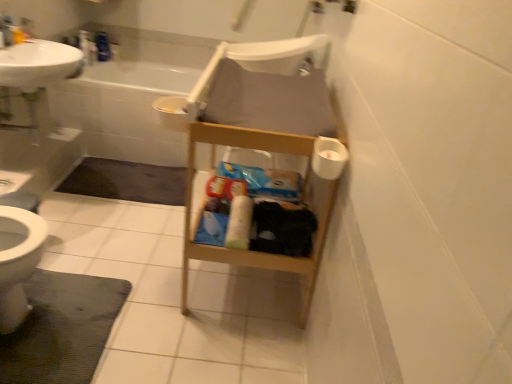
Question: Looking at their shapes, would you say white plastic chair at center is wider or thinner than dark gray textured bath mat at lower left, acting as the second bath mat starting from the top?

Choices:
 (A) thin
 (B) wide

Answer: (B)

Question: Is white plastic chair at center to the left or to the right of dark gray textured bath mat at lower left, the 1th bath mat when ordered from front to back, in the image?

Choices:
 (A) left
 (B) right

Answer: (B)

Question: Which object is positioned farthest from the white matte toilet paper at center, the second toilet paper in the right-to-left sequence?

Choices:
 (A) white plastic chair at center
 (B) white matte toilet paper at right, positioned as the 2th toilet paper in left-to-right order
 (C) dark gray textured bath mat at lower left, which is the 1th bath mat from bottom to top
 (D) dark gray carpet at lower left, which is the 1th bath mat in back-to-front order
 (E) white glossy sink at upper left

Answer: (A)

Question: Considering the real-world distances, which object is farthest from the white matte toilet paper at right, the 2th toilet paper positioned from the bottom?

Choices:
 (A) dark gray carpet at lower left, arranged as the 1th bath mat when viewed from the top
 (B) dark gray textured bath mat at lower left, the 1th bath mat when ordered from front to back
 (C) white matte toilet paper at center, placed as the 1th toilet paper when sorted from bottom to top
 (D) white plastic chair at center
 (E) white glossy sink at upper left

Answer: (D)